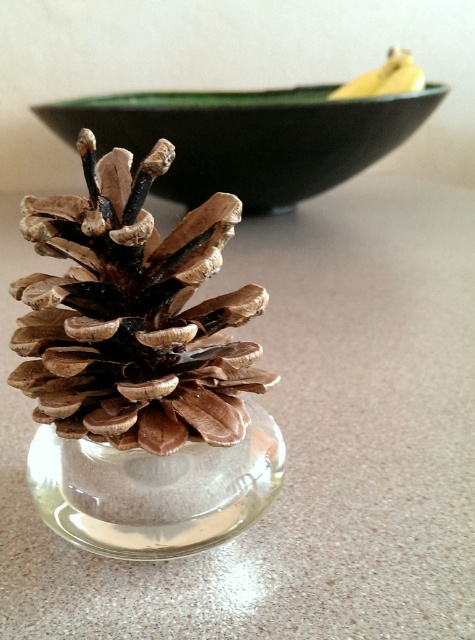
Is translucent glass table at center below transparent glass vase at center?

No.

Which is behind, point (408, 557) or point (160, 480)?

The point (408, 557) is behind.

Is point (122, 566) closer to viewer compared to point (192, 552)?

No, it is not.

Locate an element on the screen. This screenshot has height=640, width=475. translucent glass table at center is located at coordinates (300, 440).

Who is positioned more to the right, brown matte pinecone at center or transparent glass vase at center?

Positioned to the right is transparent glass vase at center.

Is brown matte pinecone at center in front of transparent glass vase at center?

Yes, brown matte pinecone at center is closer to the viewer.

This screenshot has width=475, height=640. What do you see at coordinates (133, 314) in the screenshot? I see `brown matte pinecone at center` at bounding box center [133, 314].

Find the location of `brown matte pinecone at center`. brown matte pinecone at center is located at coordinates (133, 314).

Is green matte bowl at upper center thinner than transparent glass vase at center?

In fact, green matte bowl at upper center might be wider than transparent glass vase at center.

Does point (324, 186) come closer to viewer compared to point (133, 484)?

No, (324, 186) is behind (133, 484).

The image size is (475, 640). Find the location of `green matte bowl at upper center`. green matte bowl at upper center is located at coordinates (247, 138).